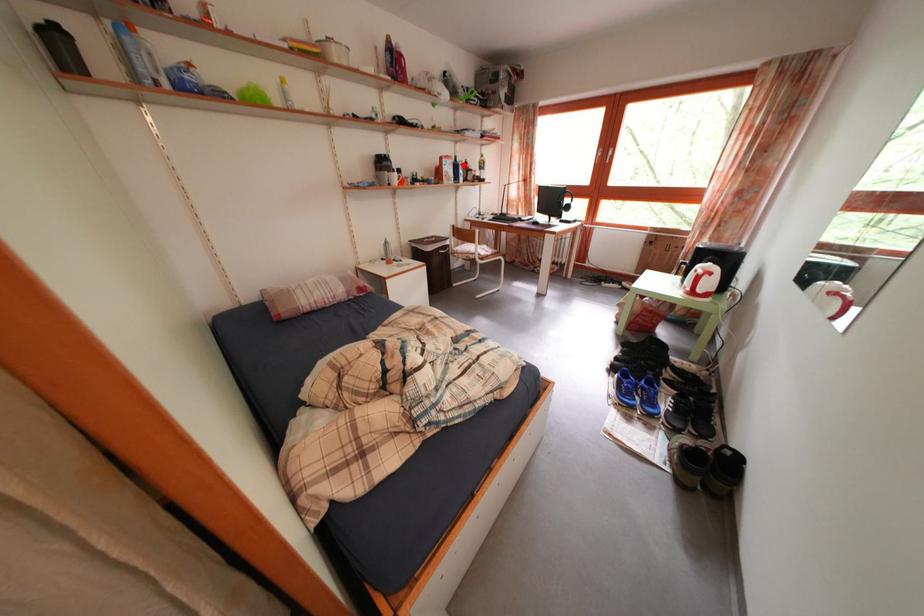
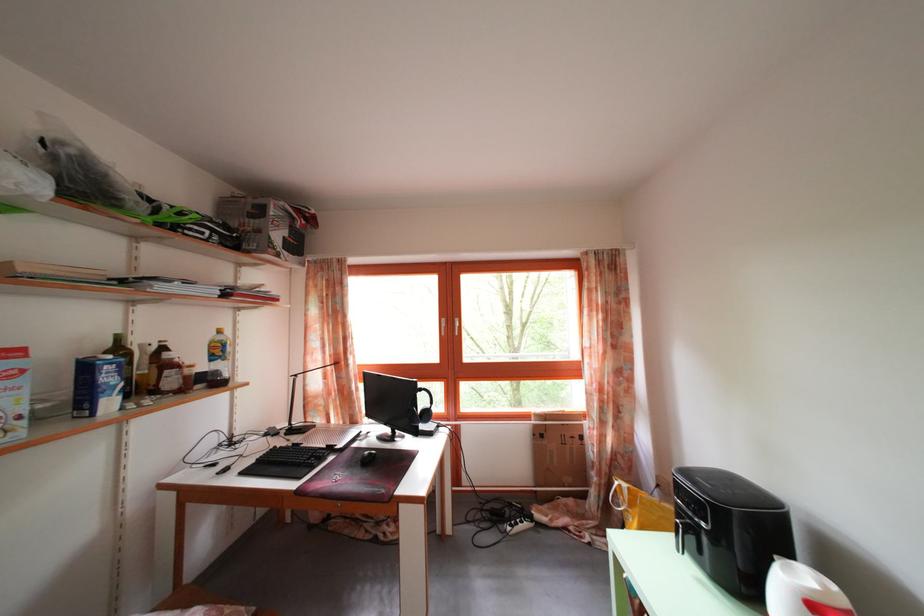
Locate, in the second image, the point that corresponds to the highlighted location in the first image.

(126, 346)